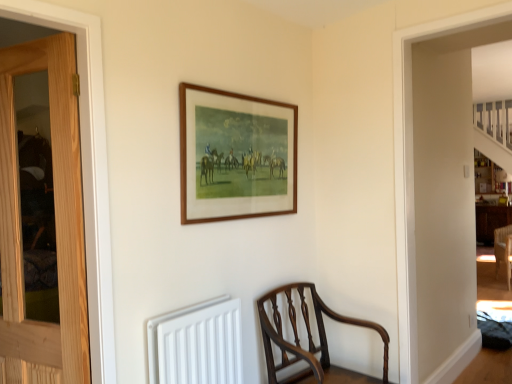
Question: From a real-world perspective, is white matte radiator at lower center under wooden picture frame at upper center?

Choices:
 (A) no
 (B) yes

Answer: (B)

Question: Is white matte radiator at lower center not near wooden picture frame at upper center?

Choices:
 (A) yes
 (B) no

Answer: (B)

Question: Can you confirm if white matte radiator at lower center is wider than wooden picture frame at upper center?

Choices:
 (A) yes
 (B) no

Answer: (A)

Question: Can you confirm if white matte radiator at lower center is thinner than wooden picture frame at upper center?

Choices:
 (A) no
 (B) yes

Answer: (A)

Question: Is white matte radiator at lower center facing towards wooden picture frame at upper center?

Choices:
 (A) yes
 (B) no

Answer: (B)

Question: From a real-world perspective, is white matte radiator at lower center physically above wooden picture frame at upper center?

Choices:
 (A) yes
 (B) no

Answer: (B)

Question: Would you say wooden picture frame at upper center contains mahogany wood chair at lower center?

Choices:
 (A) no
 (B) yes

Answer: (A)

Question: Is the surface of wooden picture frame at upper center in direct contact with mahogany wood chair at lower center?

Choices:
 (A) no
 (B) yes

Answer: (A)

Question: Can you confirm if wooden picture frame at upper center is bigger than mahogany wood chair at lower center?

Choices:
 (A) no
 (B) yes

Answer: (A)

Question: Can you confirm if wooden picture frame at upper center is shorter than mahogany wood chair at lower center?

Choices:
 (A) yes
 (B) no

Answer: (A)

Question: Can you confirm if wooden picture frame at upper center is smaller than mahogany wood chair at lower center?

Choices:
 (A) yes
 (B) no

Answer: (A)

Question: Can you confirm if wooden picture frame at upper center is thinner than mahogany wood chair at lower center?

Choices:
 (A) yes
 (B) no

Answer: (A)

Question: From a real-world perspective, is white matte radiator at lower center on top of mahogany wood chair at lower center?

Choices:
 (A) no
 (B) yes

Answer: (B)